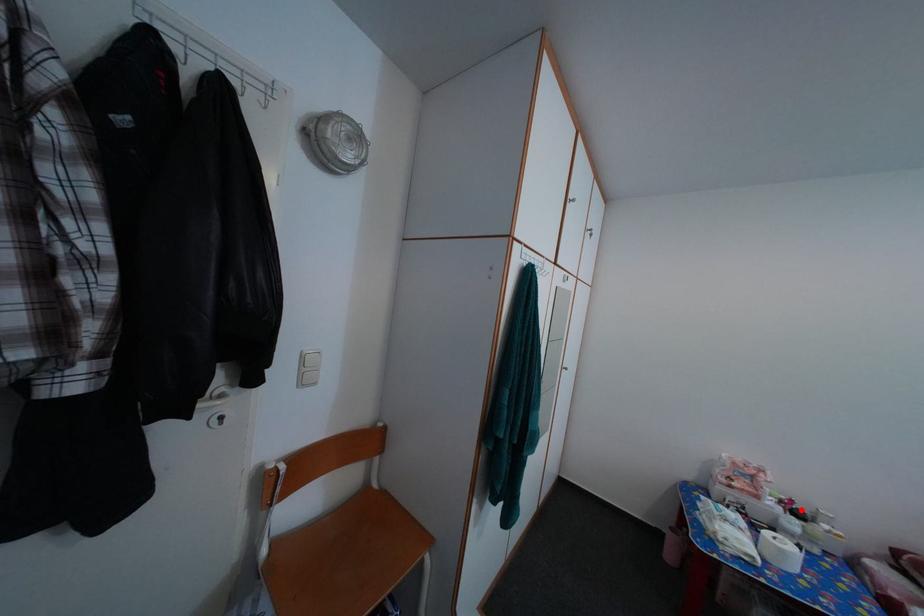
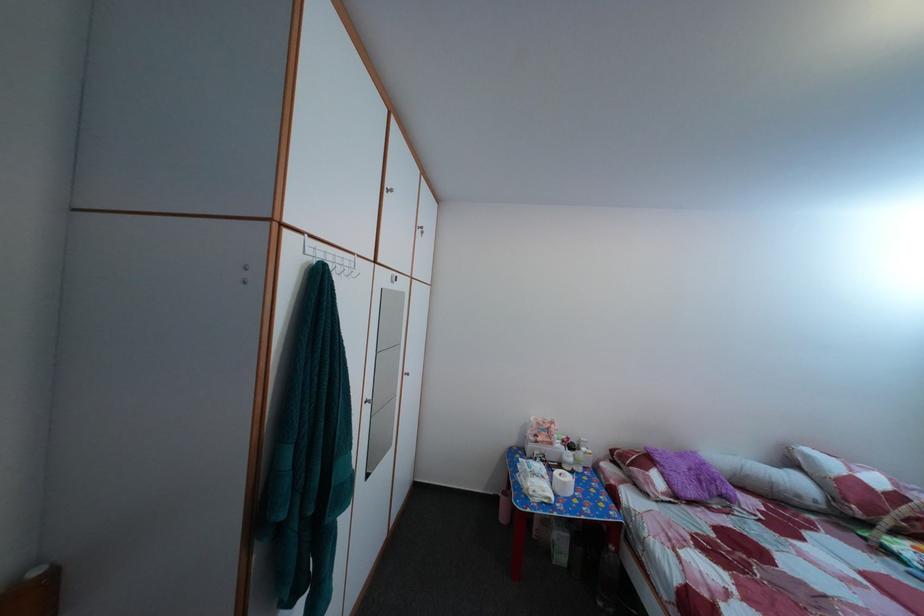
Question: I am providing you with two images of the same scene from different viewpoints. Image1 has a red point marked. In image2, the corresponding 3D location appears at what relative position? Reply with the corresponding letter.

Choices:
 (A) Closer
 (B) Farther

Answer: (B)